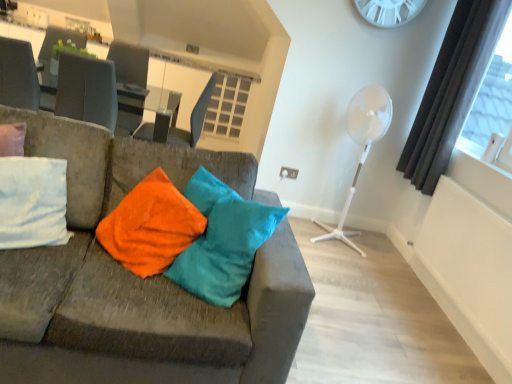
Where is `glassy white table at upper center`? This screenshot has width=512, height=384. glassy white table at upper center is located at coordinates (25, 78).

The width and height of the screenshot is (512, 384). What do you see at coordinates (362, 145) in the screenshot?
I see `white plastic fan at right` at bounding box center [362, 145].

Measure the distance between point [374,9] and camera.

A distance of 3.08 meters exists between point [374,9] and camera.

This screenshot has width=512, height=384. What do you see at coordinates (451, 89) in the screenshot?
I see `dark gray curtain at right` at bounding box center [451, 89].

Where is `velvet fabric couch at left`? Image resolution: width=512 pixels, height=384 pixels. velvet fabric couch at left is located at coordinates (139, 280).

Is matte black swivel chair at center inside white plastic clock at upper center?

No.

Does white plastic clock at upper center appear on the right side of matte black swivel chair at center?

Indeed, white plastic clock at upper center is positioned on the right side of matte black swivel chair at center.

Would you say white plastic clock at upper center is a long distance from matte black swivel chair at center?

That's right, there is a large distance between white plastic clock at upper center and matte black swivel chair at center.

What's the angular difference between white plastic clock at upper center and matte black swivel chair at center's facing directions?

white plastic clock at upper center and matte black swivel chair at center are facing 90.2 degrees away from each other.

From a real-world perspective, is glassy white table at upper center positioned above or below velvet fabric couch at left?

In terms of real-world spatial position, glassy white table at upper center is above velvet fabric couch at left.

Considering the positions of points (34, 95) and (148, 354), is point (34, 95) farther from camera compared to point (148, 354)?

That is True.

Identify the location of table on the left of velvet fabric couch at left. (25, 78).

From the image's perspective, who appears lower, glassy white table at upper center or velvet fabric couch at left?

velvet fabric couch at left is shown below in the image.

How much distance is there between matte black swivel chair at center and white plastic fan at right?

A distance of 4.30 feet exists between matte black swivel chair at center and white plastic fan at right.

Does matte black swivel chair at center turn towards white plastic fan at right?

No, matte black swivel chair at center does not turn towards white plastic fan at right.

From a real-world perspective, is matte black swivel chair at center physically located above or below white plastic fan at right?

In terms of real-world spatial position, matte black swivel chair at center is above white plastic fan at right.

In terms of size, does matte black swivel chair at center appear bigger or smaller than white plastic fan at right?

In the image, matte black swivel chair at center appears to be smaller than white plastic fan at right.

From a real-world perspective, which object rests below the other?

From a 3D spatial view, dark gray curtain at right is below.

In terms of size, does white plastic clock at upper center appear bigger or smaller than dark gray curtain at right?

Clearly, white plastic clock at upper center is smaller in size than dark gray curtain at right.

Is white plastic clock at upper center shorter than dark gray curtain at right?

Indeed, white plastic clock at upper center has a lesser height compared to dark gray curtain at right.

In the image, is white plastic clock at upper center positioned in front of or behind dark gray curtain at right?

In the image, white plastic clock at upper center appears behind dark gray curtain at right.

Is point (454, 34) behind point (39, 250)?

Yes, it is.

Is dark gray curtain at right beside velvet fabric couch at left?

dark gray curtain at right is not next to velvet fabric couch at left, and they're not touching.

Based on the photo, from the image's perspective, which one is positioned higher, dark gray curtain at right or velvet fabric couch at left?

dark gray curtain at right appears higher in the image.

Is dark gray curtain at right not within white plastic clock at upper center?

Yes, dark gray curtain at right is located beyond the bounds of white plastic clock at upper center.

From the image's perspective, between dark gray curtain at right and white plastic clock at upper center, which one is located above?

From the image's view, white plastic clock at upper center is above.

Can you confirm if dark gray curtain at right is positioned to the left of white plastic clock at upper center?

No, dark gray curtain at right is not to the left of white plastic clock at upper center.

Is dark gray curtain at right closer to camera compared to matte black swivel chair at center?

Yes, dark gray curtain at right is in front of matte black swivel chair at center.

Identify the location of swivel chair on the left of dark gray curtain at right. (194, 119).

From the picture: Is matte black swivel chair at center inside dark gray curtain at right?

No.

From the image's perspective, between dark gray curtain at right and matte black swivel chair at center, which one is located above?

dark gray curtain at right appears higher in the image.

Locate an element on the screen. clock on the right of the matte black swivel chair at center is located at coordinates (389, 11).

Image resolution: width=512 pixels, height=384 pixels. What are the coordinates of `table on the left of velvet fabric couch at left` in the screenshot? It's located at (25, 78).

Considering their positions, is matte black swivel chair at center positioned further to white plastic clock at upper center than dark gray curtain at right?

matte black swivel chair at center is further to white plastic clock at upper center.

Which object lies further to the anchor point glassy white table at upper center, velvet fabric couch at left or dark gray curtain at right?

Among the two, dark gray curtain at right is located further to glassy white table at upper center.

From the image, which object appears to be nearer to white plastic fan at right, matte black swivel chair at center or glassy white table at upper center?

matte black swivel chair at center.

Estimate the real-world distances between objects in this image. Which object is further from white plastic fan at right, matte black swivel chair at center or white plastic clock at upper center?

Based on the image, matte black swivel chair at center appears to be further to white plastic fan at right.

Based on their spatial positions, is dark gray curtain at right or glassy white table at upper center closer to velvet fabric couch at left?

glassy white table at upper center is closer to velvet fabric couch at left.

Based on their spatial positions, is dark gray curtain at right or white plastic fan at right closer to matte black swivel chair at center?

white plastic fan at right is closer to matte black swivel chair at center.

From the image, which object appears to be nearer to white plastic fan at right, dark gray curtain at right or matte black swivel chair at center?

Based on the image, dark gray curtain at right appears to be nearer to white plastic fan at right.

When comparing their distances from glassy white table at upper center, does velvet fabric couch at left or white plastic clock at upper center seem further?

Based on the image, white plastic clock at upper center appears to be further to glassy white table at upper center.

Locate an element on the screen. Image resolution: width=512 pixels, height=384 pixels. clock positioned between velvet fabric couch at left and matte black swivel chair at center from near to far is located at coordinates (389, 11).

Image resolution: width=512 pixels, height=384 pixels. In order to click on fan between velvet fabric couch at left and white plastic clock at upper center along the z-axis in this screenshot , I will do `click(362, 145)`.

Where is `fan between glassy white table at upper center and dark gray curtain at right from left to right`? fan between glassy white table at upper center and dark gray curtain at right from left to right is located at coordinates click(x=362, y=145).

Where is `swivel chair between glassy white table at upper center and white plastic clock at upper center`? swivel chair between glassy white table at upper center and white plastic clock at upper center is located at coordinates coord(194,119).